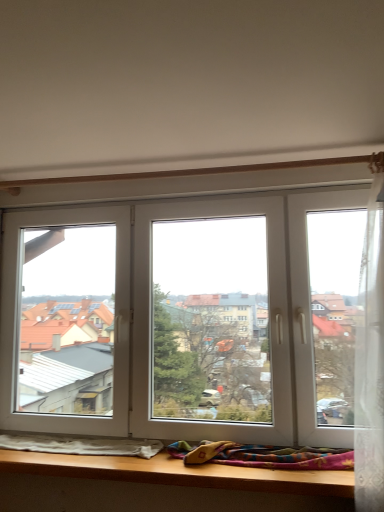
Question: From a real-world perspective, does multicolored woven blanket at lower center, the first blanket when ordered from right to left, sit lower than white soft blanket at lower left, arranged as the first blanket when viewed from the left?

Choices:
 (A) no
 (B) yes

Answer: (A)

Question: Considering the relative positions of multicolored woven blanket at lower center, the 2th blanket positioned from the left, and white soft blanket at lower left, arranged as the first blanket when viewed from the left, in the image provided, is multicolored woven blanket at lower center, the 2th blanket positioned from the left, to the right of white soft blanket at lower left, arranged as the first blanket when viewed from the left, from the viewer's perspective?

Choices:
 (A) no
 (B) yes

Answer: (B)

Question: Could white soft blanket at lower left, arranged as the first blanket when viewed from the left, be considered to be inside multicolored woven blanket at lower center, the 2th blanket positioned from the left?

Choices:
 (A) yes
 (B) no

Answer: (B)

Question: Can you confirm if multicolored woven blanket at lower center, the 2th blanket positioned from the left, is shorter than white soft blanket at lower left, which appears as the 2th blanket when viewed from the right?

Choices:
 (A) no
 (B) yes

Answer: (A)

Question: Does multicolored woven blanket at lower center, the first blanket when ordered from right to left, turn towards white soft blanket at lower left, arranged as the first blanket when viewed from the left?

Choices:
 (A) no
 (B) yes

Answer: (A)

Question: Can you confirm if multicolored woven blanket at lower center, the first blanket when ordered from right to left, is smaller than white soft blanket at lower left, arranged as the first blanket when viewed from the left?

Choices:
 (A) no
 (B) yes

Answer: (A)

Question: Is white soft blanket at lower left, arranged as the first blanket when viewed from the left, oriented towards multicolored woven blanket at lower center, the first blanket when ordered from right to left?

Choices:
 (A) no
 (B) yes

Answer: (A)

Question: Can you confirm if white soft blanket at lower left, arranged as the first blanket when viewed from the left, is positioned to the left of multicolored woven blanket at lower center, the first blanket when ordered from right to left?

Choices:
 (A) yes
 (B) no

Answer: (A)

Question: Can you confirm if white soft blanket at lower left, arranged as the first blanket when viewed from the left, is wider than multicolored woven blanket at lower center, the 2th blanket positioned from the left?

Choices:
 (A) yes
 (B) no

Answer: (B)

Question: From the image's perspective, is white soft blanket at lower left, arranged as the first blanket when viewed from the left, beneath multicolored woven blanket at lower center, the 2th blanket positioned from the left?

Choices:
 (A) yes
 (B) no

Answer: (A)

Question: Can you confirm if white soft blanket at lower left, which appears as the 2th blanket when viewed from the right, is positioned to the right of multicolored woven blanket at lower center, the 2th blanket positioned from the left?

Choices:
 (A) yes
 (B) no

Answer: (B)

Question: Considering the relative sizes of white soft blanket at lower left, which appears as the 2th blanket when viewed from the right, and multicolored woven blanket at lower center, the 2th blanket positioned from the left, in the image provided, is white soft blanket at lower left, which appears as the 2th blanket when viewed from the right, shorter than multicolored woven blanket at lower center, the 2th blanket positioned from the left,?

Choices:
 (A) no
 (B) yes

Answer: (B)

Question: Based on their sizes in the image, would you say white soft blanket at lower left, arranged as the first blanket when viewed from the left, is bigger or smaller than multicolored woven blanket at lower center, the first blanket when ordered from right to left?

Choices:
 (A) small
 (B) big

Answer: (A)